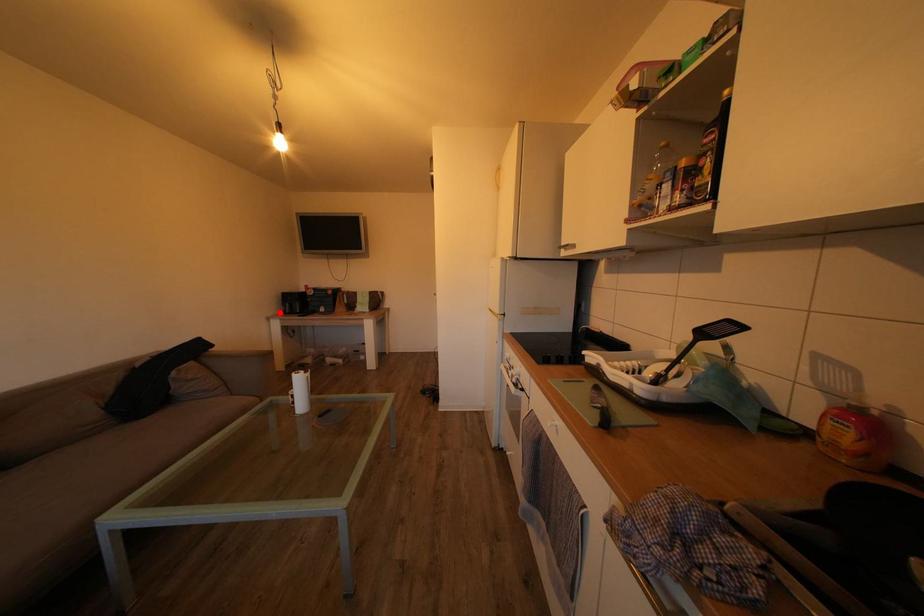
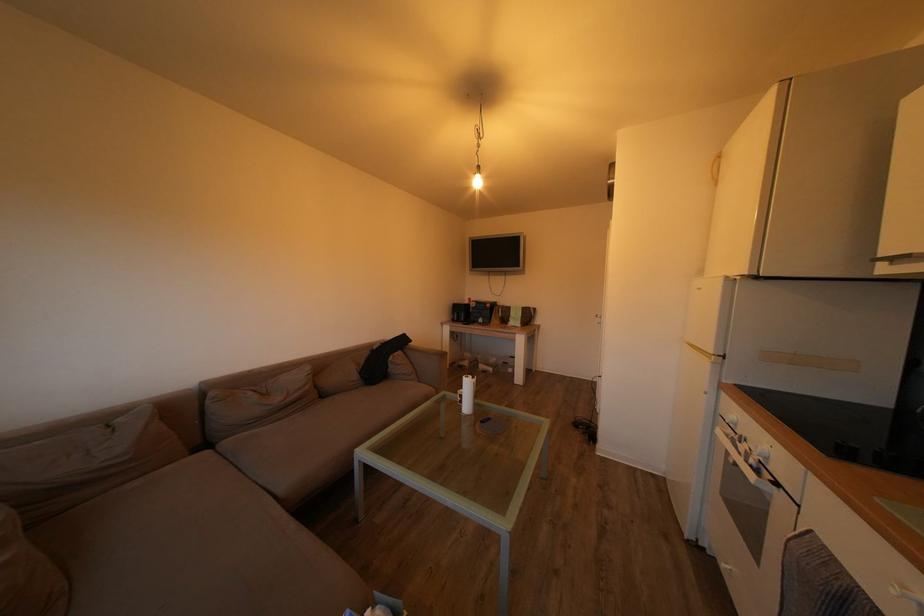
Question: A red point is marked in image1. In image2, is the corresponding 3D point closer to the camera or farther? Reply with the corresponding letter.

Choices:
 (A) The corresponding 3D point is closer.
 (B) The corresponding 3D point is farther.

Answer: (B)